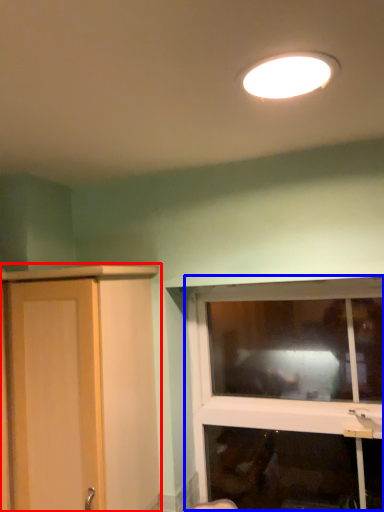
Question: Which object appears closest to the camera in this image, cupboard (highlighted by a red box) or window (highlighted by a blue box)?

Choices:
 (A) cupboard
 (B) window

Answer: (A)